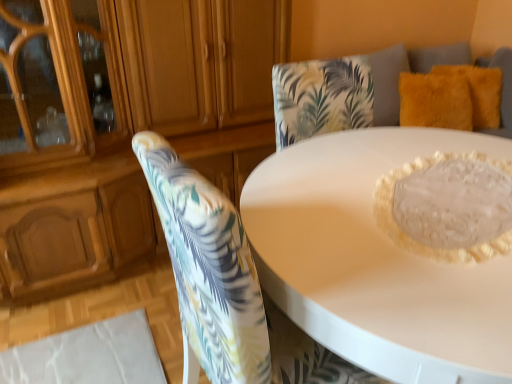
Question: Is translucent glass cake at center wider or thinner than matte wood dresser at upper left?

Choices:
 (A) thin
 (B) wide

Answer: (A)

Question: From the image's perspective, is translucent glass cake at center positioned above or below matte wood dresser at upper left?

Choices:
 (A) above
 (B) below

Answer: (B)

Question: Which is farther from the matte wood dresser at upper left?

Choices:
 (A) floral fabric chair at center
 (B) fuzzy yellow pillow at upper right, the 2th pillow positioned from the right
 (C) translucent glass cake at center
 (D) white glossy table at center
 (E) fuzzy yellow pillow at upper right, positioned as the first pillow in right-to-left order

Answer: (E)

Question: Which object is the closest to the white glossy table at center?

Choices:
 (A) translucent glass cake at center
 (B) fuzzy yellow pillow at upper right, the 2th pillow positioned from the right
 (C) matte wood dresser at upper left
 (D) fuzzy yellow pillow at upper right, positioned as the first pillow in right-to-left order
 (E) floral fabric chair at center

Answer: (A)